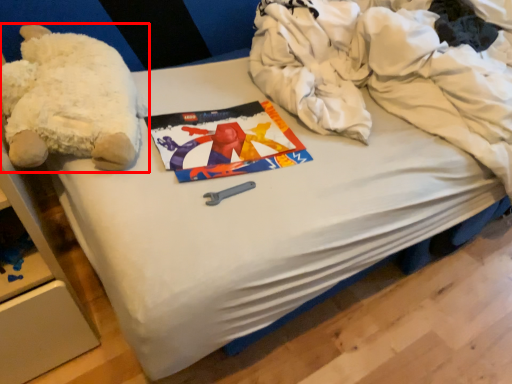
Question: From the image's perspective, what is the correct spatial positioning of teddy bear (annotated by the red box) in reference to clothing?

Choices:
 (A) above
 (B) below

Answer: (B)